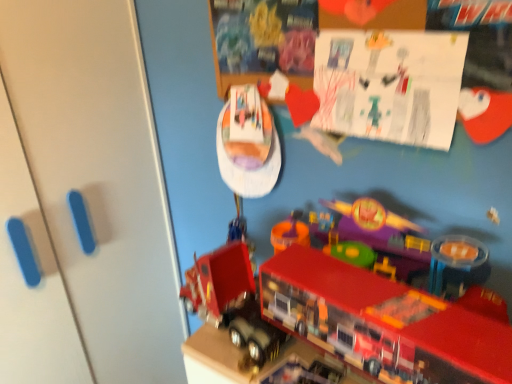
Image resolution: width=512 pixels, height=384 pixels. Describe the element at coordinates (354, 301) in the screenshot. I see `shiny plastic fire truck at lower right, the 2th toy in the bottom-to-top sequence` at that location.

Locate an element on the screen. The height and width of the screenshot is (384, 512). shiny plastic fire truck at lower right, the 2th toy in the bottom-to-top sequence is located at coordinates (354, 301).

At what (x,y) coordinates should I click in order to perform the action: click on shiny plastic toy truck at lower center, acting as the 1th toy starting from the bottom. Please return your answer as a coordinate pair (x, y). This screenshot has height=384, width=512. Looking at the image, I should click on (302, 373).

The height and width of the screenshot is (384, 512). What do you see at coordinates (98, 176) in the screenshot? I see `white matte door at left` at bounding box center [98, 176].

This screenshot has height=384, width=512. I want to click on shiny plastic fire truck at lower right, marked as the second toy in a top-to-bottom arrangement, so click(x=354, y=301).

Measure the distance between white matte door at left and shiny plastic toy truck at lower center, positioned as the third toy in top-to-bottom order.

white matte door at left and shiny plastic toy truck at lower center, positioned as the third toy in top-to-bottom order, are 30.36 inches apart from each other.

From a real-world perspective, is white matte door at left on shiny plastic toy truck at lower center, positioned as the third toy in top-to-bottom order?

No, from a real-world perspective, white matte door at left is not above shiny plastic toy truck at lower center, positioned as the third toy in top-to-bottom order.

How many degrees apart are the facing directions of white matte door at left and shiny plastic toy truck at lower center, acting as the 1th toy starting from the bottom?

The angular difference between white matte door at left and shiny plastic toy truck at lower center, acting as the 1th toy starting from the bottom, is 101 degrees.

Considering the relative sizes of white matte door at left and shiny plastic toy truck at lower center, positioned as the third toy in top-to-bottom order, in the image provided, is white matte door at left thinner than shiny plastic toy truck at lower center, positioned as the third toy in top-to-bottom order,?

No, white matte door at left is not thinner than shiny plastic toy truck at lower center, positioned as the third toy in top-to-bottom order.

Does shiny plastic toy truck at lower center, positioned as the third toy in top-to-bottom order, have a larger size compared to white matte door at left?

Incorrect, shiny plastic toy truck at lower center, positioned as the third toy in top-to-bottom order, is not larger than white matte door at left.

Could you tell me if shiny plastic toy truck at lower center, positioned as the third toy in top-to-bottom order, is facing white matte door at left?

No, shiny plastic toy truck at lower center, positioned as the third toy in top-to-bottom order, is not facing towards white matte door at left.

From a real-world perspective, which object rests below the other?

From a 3D spatial view, white matte door at left is below.

From the image's perspective, which one is positioned higher, shiny plastic toy boat at upper center, positioned as the 1th toy in top-to-bottom order, or shiny plastic toy truck at lower center, acting as the 1th toy starting from the bottom?

shiny plastic toy boat at upper center, positioned as the 1th toy in top-to-bottom order.

Identify the location of toy behind the shiny plastic toy truck at lower center, acting as the 1th toy starting from the bottom. This screenshot has height=384, width=512. (248, 144).

Does point (249, 108) lie behind point (324, 382)?

Yes, point (249, 108) is behind point (324, 382).

From a real-world perspective, is shiny plastic toy boat at upper center, positioned as the 1th toy in top-to-bottom order, over shiny plastic toy truck at lower center, positioned as the third toy in top-to-bottom order?

Yes, from a real-world perspective, shiny plastic toy boat at upper center, positioned as the 1th toy in top-to-bottom order, is over shiny plastic toy truck at lower center, positioned as the third toy in top-to-bottom order

From the image's perspective, is shiny plastic fire truck at lower right, the 2th toy in the bottom-to-top sequence, on top of shiny plastic toy boat at upper center, placed as the 3th toy when sorted from bottom to top?

No, from the image's perspective, shiny plastic fire truck at lower right, the 2th toy in the bottom-to-top sequence, is not above shiny plastic toy boat at upper center, placed as the 3th toy when sorted from bottom to top.

From the picture: Considering the relative sizes of shiny plastic fire truck at lower right, the 2th toy in the bottom-to-top sequence, and shiny plastic toy boat at upper center, positioned as the 1th toy in top-to-bottom order, in the image provided, is shiny plastic fire truck at lower right, the 2th toy in the bottom-to-top sequence, taller than shiny plastic toy boat at upper center, positioned as the 1th toy in top-to-bottom order,?

Incorrect, the height of shiny plastic fire truck at lower right, the 2th toy in the bottom-to-top sequence, is not larger of that of shiny plastic toy boat at upper center, positioned as the 1th toy in top-to-bottom order.

Consider the image. Does shiny plastic fire truck at lower right, marked as the second toy in a top-to-bottom arrangement, appear on the left side of shiny plastic toy boat at upper center, placed as the 3th toy when sorted from bottom to top?

Incorrect, shiny plastic fire truck at lower right, marked as the second toy in a top-to-bottom arrangement, is not on the left side of shiny plastic toy boat at upper center, placed as the 3th toy when sorted from bottom to top.

Could you tell me if shiny plastic fire truck at lower right, marked as the second toy in a top-to-bottom arrangement, is turned towards shiny plastic toy boat at upper center, placed as the 3th toy when sorted from bottom to top?

No, shiny plastic fire truck at lower right, marked as the second toy in a top-to-bottom arrangement, does not turn towards shiny plastic toy boat at upper center, placed as the 3th toy when sorted from bottom to top.

From a real-world perspective, who is located higher, white matte door at left or shiny plastic fire truck at lower right, the 2th toy in the bottom-to-top sequence?

shiny plastic fire truck at lower right, the 2th toy in the bottom-to-top sequence.

Does white matte door at left contain shiny plastic fire truck at lower right, the 2th toy in the bottom-to-top sequence?

No, shiny plastic fire truck at lower right, the 2th toy in the bottom-to-top sequence, is not inside white matte door at left.

Between point (140, 276) and point (411, 331), which one is positioned behind?

Positioned behind is point (140, 276).

Considering the relative sizes of white matte door at left and shiny plastic fire truck at lower right, the 2th toy in the bottom-to-top sequence, in the image provided, is white matte door at left bigger than shiny plastic fire truck at lower right, the 2th toy in the bottom-to-top sequence,?

Correct, white matte door at left is larger in size than shiny plastic fire truck at lower right, the 2th toy in the bottom-to-top sequence.

How distant is white matte door at left from shiny plastic toy boat at upper center, positioned as the 1th toy in top-to-bottom order?

white matte door at left and shiny plastic toy boat at upper center, positioned as the 1th toy in top-to-bottom order, are 16.59 inches apart from each other.

From the image's perspective, which is below, white matte door at left or shiny plastic toy boat at upper center, placed as the 3th toy when sorted from bottom to top?

white matte door at left is shown below in the image.

Which is in front, white matte door at left or shiny plastic toy boat at upper center, placed as the 3th toy when sorted from bottom to top?

Positioned in front is white matte door at left.

Locate an element on the screen. Image resolution: width=512 pixels, height=384 pixels. toy that is the 1st one when counting rightward from the white matte door at left is located at coordinates (248, 144).

Considering the points (272, 378) and (243, 332), which point is in front, point (272, 378) or point (243, 332)?

The point (272, 378) is closer to the camera.

Choose the correct answer: Is shiny plastic toy truck at lower center, positioned as the third toy in top-to-bottom order, inside shiny plastic fire truck at lower right, marked as the second toy in a top-to-bottom arrangement, or outside it?

shiny plastic toy truck at lower center, positioned as the third toy in top-to-bottom order, is spatially positioned inside shiny plastic fire truck at lower right, marked as the second toy in a top-to-bottom arrangement.

Who is more distant, shiny plastic toy truck at lower center, positioned as the third toy in top-to-bottom order, or shiny plastic fire truck at lower right, the 2th toy in the bottom-to-top sequence?

shiny plastic toy truck at lower center, positioned as the third toy in top-to-bottom order, is further away from the camera.

Between shiny plastic toy truck at lower center, acting as the 1th toy starting from the bottom, and shiny plastic fire truck at lower right, the 2th toy in the bottom-to-top sequence, which one appears on the left side from the viewer's perspective?

From the viewer's perspective, shiny plastic toy truck at lower center, acting as the 1th toy starting from the bottom, appears more on the left side.

At what (x,y) coordinates should I click in order to perform the action: click on door below the shiny plastic toy truck at lower center, positioned as the third toy in top-to-bottom order (from a real-world perspective). Please return your answer as a coordinate pair (x, y). This screenshot has width=512, height=384. Looking at the image, I should click on (98, 176).

Locate an element on the screen. toy below the white matte door at left (from the image's perspective) is located at coordinates (302, 373).

Based on their spatial positions, is shiny plastic toy truck at lower center, positioned as the third toy in top-to-bottom order, or shiny plastic fire truck at lower right, marked as the second toy in a top-to-bottom arrangement, further from white matte door at left?

shiny plastic toy truck at lower center, positioned as the third toy in top-to-bottom order, is further to white matte door at left.

Which object lies further to the anchor point shiny plastic toy boat at upper center, positioned as the 1th toy in top-to-bottom order, white matte door at left or shiny plastic fire truck at lower right, marked as the second toy in a top-to-bottom arrangement?

white matte door at left is further to shiny plastic toy boat at upper center, positioned as the 1th toy in top-to-bottom order.

Based on their spatial positions, is shiny plastic toy boat at upper center, positioned as the 1th toy in top-to-bottom order, or white matte door at left further from shiny plastic fire truck at lower right, the 2th toy in the bottom-to-top sequence?

white matte door at left is further to shiny plastic fire truck at lower right, the 2th toy in the bottom-to-top sequence.

Based on their spatial positions, is shiny plastic fire truck at lower right, marked as the second toy in a top-to-bottom arrangement, or white matte door at left further from shiny plastic toy truck at lower center, acting as the 1th toy starting from the bottom?

white matte door at left is positioned further to the anchor shiny plastic toy truck at lower center, acting as the 1th toy starting from the bottom.

Estimate the real-world distances between objects in this image. Which object is closer to shiny plastic toy boat at upper center, placed as the 3th toy when sorted from bottom to top, shiny plastic toy truck at lower center, positioned as the third toy in top-to-bottom order, or white matte door at left?

Among the two, white matte door at left is located nearer to shiny plastic toy boat at upper center, placed as the 3th toy when sorted from bottom to top.

Estimate the real-world distances between objects in this image. Which object is further from shiny plastic fire truck at lower right, the 2th toy in the bottom-to-top sequence, white matte door at left or shiny plastic toy boat at upper center, positioned as the 1th toy in top-to-bottom order?

The object further to shiny plastic fire truck at lower right, the 2th toy in the bottom-to-top sequence, is white matte door at left.

Which object lies nearer to the anchor point shiny plastic toy truck at lower center, acting as the 1th toy starting from the bottom, shiny plastic toy boat at upper center, placed as the 3th toy when sorted from bottom to top, or white matte door at left?

shiny plastic toy boat at upper center, placed as the 3th toy when sorted from bottom to top, lies closer to shiny plastic toy truck at lower center, acting as the 1th toy starting from the bottom, than the other object.

Based on their spatial positions, is shiny plastic toy truck at lower center, acting as the 1th toy starting from the bottom, or shiny plastic toy boat at upper center, positioned as the 1th toy in top-to-bottom order, closer to white matte door at left?

shiny plastic toy boat at upper center, positioned as the 1th toy in top-to-bottom order, is closer to white matte door at left.

This screenshot has width=512, height=384. I want to click on toy between shiny plastic toy boat at upper center, positioned as the 1th toy in top-to-bottom order, and shiny plastic toy truck at lower center, acting as the 1th toy starting from the bottom, in the up-down direction, so click(354, 301).

Locate an element on the screen. This screenshot has height=384, width=512. toy between white matte door at left and shiny plastic toy truck at lower center, acting as the 1th toy starting from the bottom, from left to right is located at coordinates (248, 144).